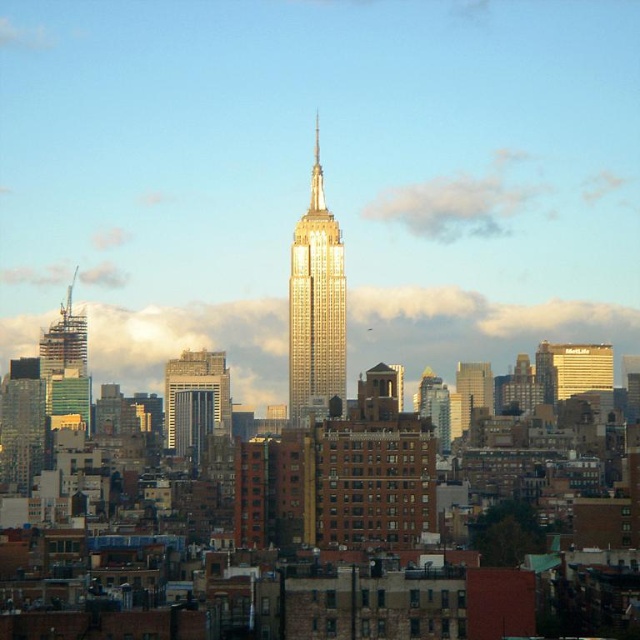
Question: From the image, what is the correct spatial relationship of gold metallic building at center in relation to gray concrete skyscraper at center?

Choices:
 (A) left
 (B) right

Answer: (B)

Question: Which point is farther from the camera taking this photo?

Choices:
 (A) (580, 376)
 (B) (56, 320)

Answer: (A)

Question: Which object appears closest to the camera in this image?

Choices:
 (A) white fluffy cloud at upper center
 (B) green glass building at left

Answer: (A)

Question: Which point appears closest to the camera in this image?

Choices:
 (A) [56, 378]
 (B) [444, 348]
 (C) [605, 372]
 (D) [173, 449]

Answer: (B)

Question: Does gray concrete skyscraper at center have a smaller size compared to glassy reflective skyscraper at center?

Choices:
 (A) no
 (B) yes

Answer: (A)

Question: Does shiny gold skyscraper at center appear over green glass building at left?

Choices:
 (A) yes
 (B) no

Answer: (A)